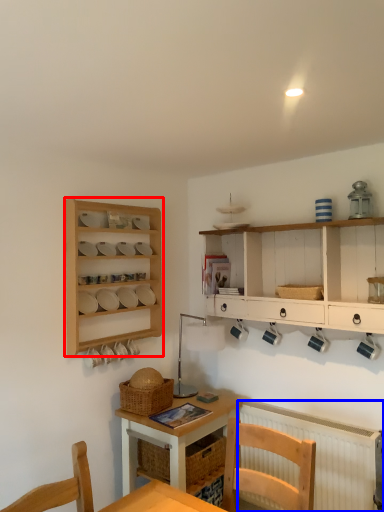
Question: Among these objects, which one is nearest to the camera, shelf (highlighted by a red box) or radiator (highlighted by a blue box)?

Choices:
 (A) shelf
 (B) radiator

Answer: (B)